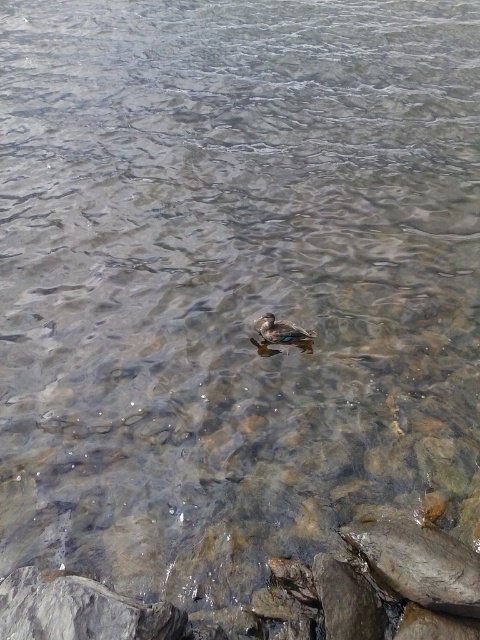
Question: Among these points, which one is nearest to the camera?

Choices:
 (A) (169, 624)
 (B) (398, 584)

Answer: (A)

Question: Among these points, which one is nearest to the camera?

Choices:
 (A) (160, 624)
 (B) (471, 570)
 (C) (276, 340)

Answer: (A)

Question: Can you confirm if smooth gray rock at lower right is bigger than brown matte duck at center?

Choices:
 (A) no
 (B) yes

Answer: (B)

Question: Does gray rough rock at lower left come in front of brown matte duck at center?

Choices:
 (A) yes
 (B) no

Answer: (A)

Question: Which point is closer to the camera taking this photo?

Choices:
 (A) (436, 563)
 (B) (127, 621)

Answer: (B)

Question: Does smooth gray rock at lower right have a smaller size compared to brown matte duck at center?

Choices:
 (A) yes
 (B) no

Answer: (B)